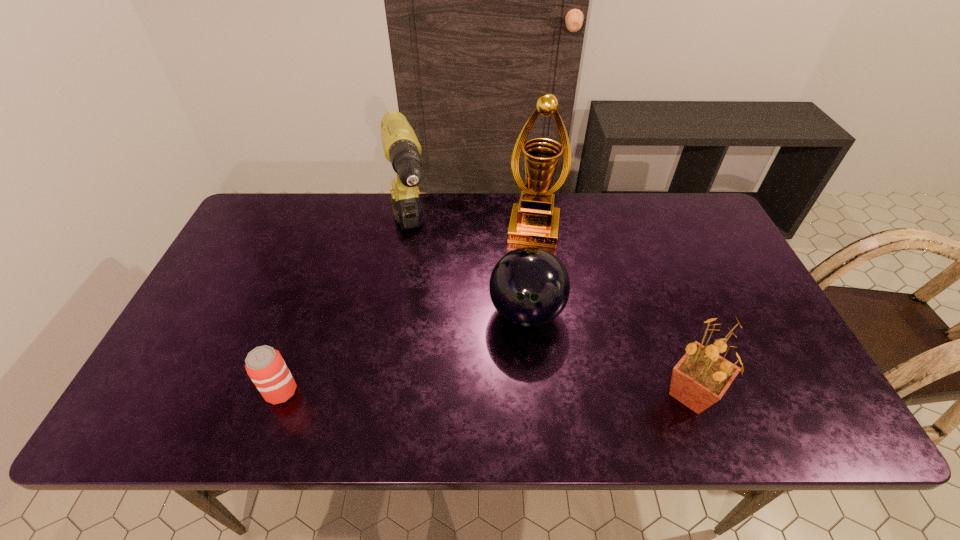
Image resolution: width=960 pixels, height=540 pixels. Identify the location of vacant space on the desktop that is between the leftmost object and the rightmost object and is positioned on the handle side of the fourth object from right to left. (455, 393).

This screenshot has width=960, height=540. What are the coordinates of `free space on the desktop that is between the leftmost object and the third tallest object and is positioned on the front-facing side of the tallest object` in the screenshot? It's located at (510, 393).

You are a GUI agent. You are given a task and a screenshot of the screen. Output one action in this format:
    pyautogui.click(x=<x>, y=<y>)
    Task: Click on the free space on the desktop that is between the beer can and the third shortest object and is positioned on the side of the third farthest object with the finger holes
    Image resolution: width=960 pixels, height=540 pixels.
    Given the screenshot: What is the action you would take?
    [x=534, y=393]